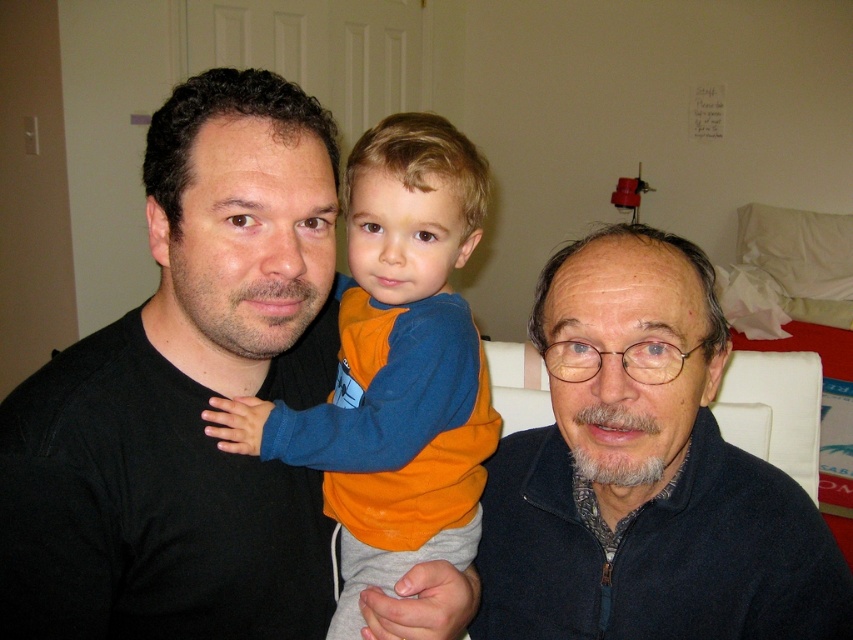
Question: Which point is farther to the camera?

Choices:
 (A) (456, 324)
 (B) (694, 481)

Answer: (A)

Question: Among these objects, which one is nearest to the camera?

Choices:
 (A) orange fleece at center
 (B) dark blue fleece at center

Answer: (B)

Question: Which point is closer to the camera taking this photo?

Choices:
 (A) (218, 412)
 (B) (619, 387)

Answer: (B)

Question: Is the position of dark blue fleece at center more distant than that of orange fleece at center?

Choices:
 (A) no
 (B) yes

Answer: (A)

Question: Does dark blue fleece at center appear under orange fleece at center?

Choices:
 (A) no
 (B) yes

Answer: (B)

Question: Does dark blue fleece at center appear on the right side of orange fleece at center?

Choices:
 (A) no
 (B) yes

Answer: (B)